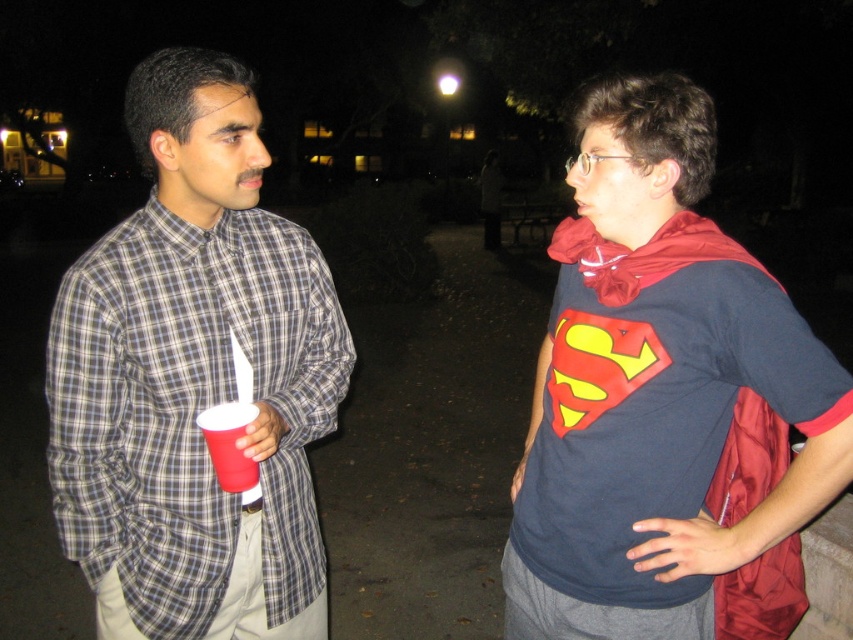
Can you confirm if red fabric cape at center is wider than matte plastic cup at left?

Correct, the width of red fabric cape at center exceeds that of matte plastic cup at left.

Can you confirm if red fabric cape at center is positioned to the right of matte plastic cup at left?

Yes, red fabric cape at center is to the right of matte plastic cup at left.

The height and width of the screenshot is (640, 853). Find the location of `red fabric cape at center`. red fabric cape at center is located at coordinates (665, 401).

Where is `red fabric cape at center`? red fabric cape at center is located at coordinates (665, 401).

Between red fabric cape at center and plaid shirt at center, which one has less height?

Standing shorter between the two is red fabric cape at center.

Locate an element on the screen. The width and height of the screenshot is (853, 640). red fabric cape at center is located at coordinates (665, 401).

Where is `red fabric cape at center`? red fabric cape at center is located at coordinates (665, 401).

Does plaid shirt at center have a greater height compared to matte plastic cup at left?

Indeed, plaid shirt at center has a greater height compared to matte plastic cup at left.

Is plaid shirt at center positioned in front of matte plastic cup at left?

No, plaid shirt at center is further to the viewer.

Which is in front, point (160, 275) or point (218, 465)?

Point (218, 465) is in front.

Locate an element on the screen. Image resolution: width=853 pixels, height=640 pixels. plaid shirt at center is located at coordinates (194, 378).